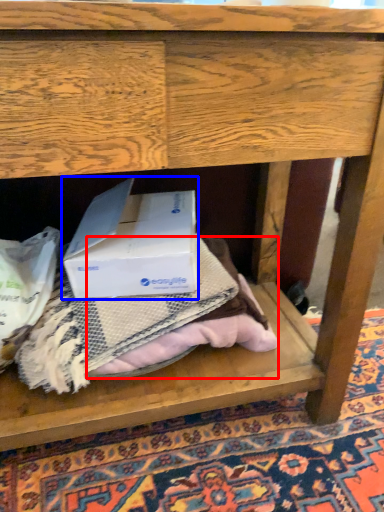
Question: Which object is closer to the camera taking this photo, clothing (highlighted by a red box) or box (highlighted by a blue box)?

Choices:
 (A) clothing
 (B) box

Answer: (B)